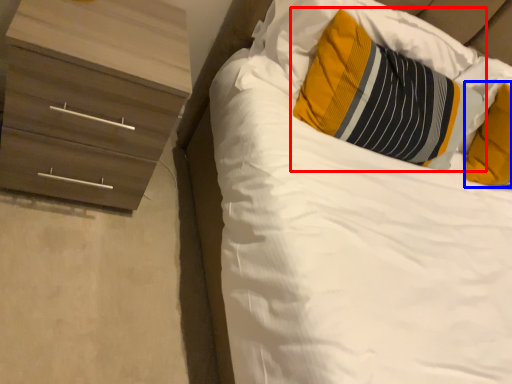
Question: Which object is closer to the camera taking this photo, pillow (highlighted by a red box) or pillow (highlighted by a blue box)?

Choices:
 (A) pillow
 (B) pillow

Answer: (A)